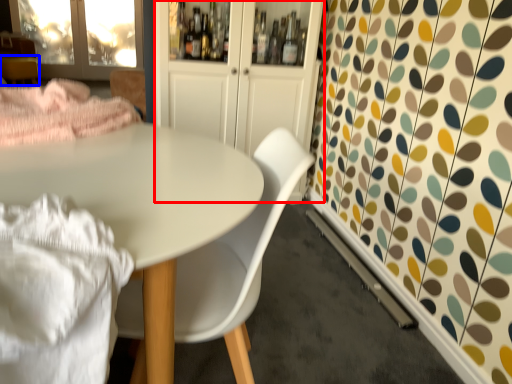
Question: Among these objects, which one is nearest to the camera, dresser (highlighted by a red box) or side table (highlighted by a blue box)?

Choices:
 (A) dresser
 (B) side table

Answer: (A)